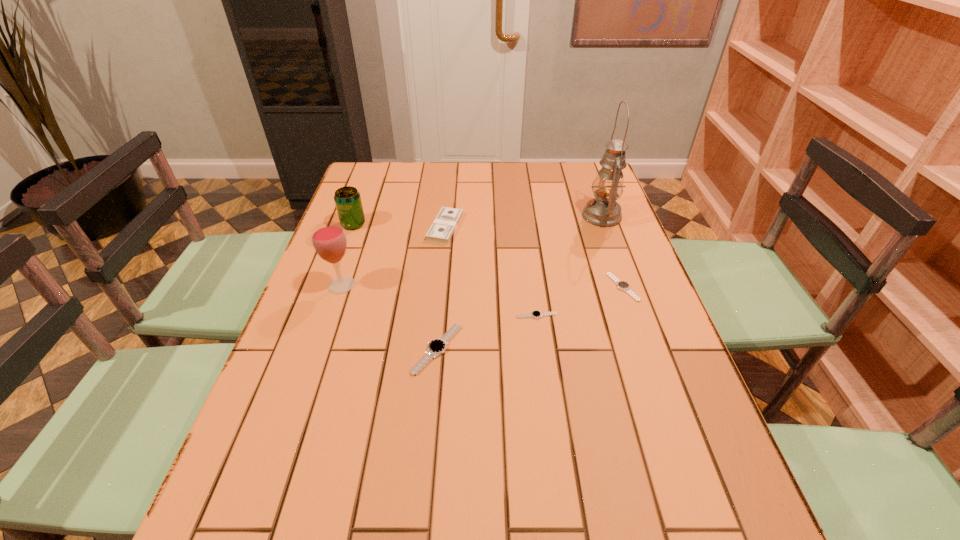
Choose which watch is the nearest neighbor to the tallest object. Please provide its 2D coordinates. Your answer should be formatted as a tuple, i.e. [(x, y)], where the tuple contains the x and y coordinates of a point satisfying the conditions above.

[(622, 285)]

Identify the location of free location that satisfies the following two spatial constraints: 1. on the front side of the shortest object; 2. on the right side of the beer can. (320, 316).

I want to click on blank area in the image that satisfies the following two spatial constraints: 1. on the back side of the fourth shortest object; 2. on the right side of the wineglass, so click(362, 227).